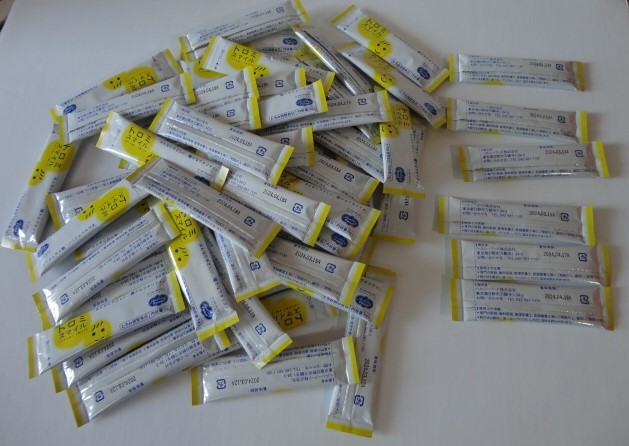
I want to click on pile of identical products on a table, so click(245, 212).